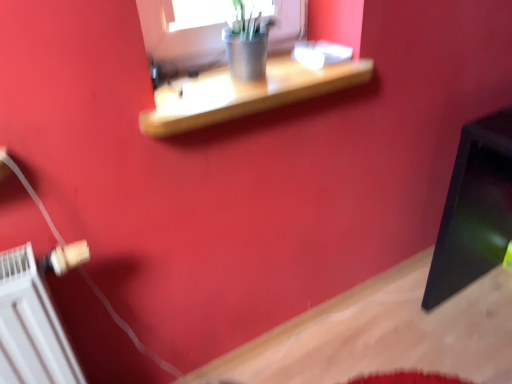
Question: Is white plastic radiator at lower left positioned with its back to wooden shelf at upper center?

Choices:
 (A) no
 (B) yes

Answer: (A)

Question: Considering the relative sizes of white plastic radiator at lower left and wooden shelf at upper center in the image provided, is white plastic radiator at lower left taller than wooden shelf at upper center?

Choices:
 (A) yes
 (B) no

Answer: (A)

Question: From a real-world perspective, is white plastic radiator at lower left on top of wooden shelf at upper center?

Choices:
 (A) yes
 (B) no

Answer: (B)

Question: Does white plastic radiator at lower left have a larger size compared to wooden shelf at upper center?

Choices:
 (A) yes
 (B) no

Answer: (A)

Question: Can you confirm if white plastic radiator at lower left is wider than wooden shelf at upper center?

Choices:
 (A) no
 (B) yes

Answer: (A)

Question: Does white plastic radiator at lower left have a lesser height compared to wooden shelf at upper center?

Choices:
 (A) yes
 (B) no

Answer: (B)

Question: Is wooden shelf at upper center positioned before white plastic radiator at lower left?

Choices:
 (A) no
 (B) yes

Answer: (A)

Question: Is wooden shelf at upper center touching white plastic radiator at lower left?

Choices:
 (A) no
 (B) yes

Answer: (A)

Question: From a real-world perspective, does wooden shelf at upper center sit lower than white plastic radiator at lower left?

Choices:
 (A) yes
 (B) no

Answer: (B)

Question: Is wooden shelf at upper center positioned with its back to white plastic radiator at lower left?

Choices:
 (A) no
 (B) yes

Answer: (A)

Question: Can you confirm if wooden shelf at upper center is shorter than white plastic radiator at lower left?

Choices:
 (A) no
 (B) yes

Answer: (B)

Question: Considering the relative sizes of wooden shelf at upper center and white plastic radiator at lower left in the image provided, is wooden shelf at upper center thinner than white plastic radiator at lower left?

Choices:
 (A) yes
 (B) no

Answer: (B)

Question: Is white plastic radiator at lower left bigger or smaller than wooden shelf at upper center?

Choices:
 (A) small
 (B) big

Answer: (B)